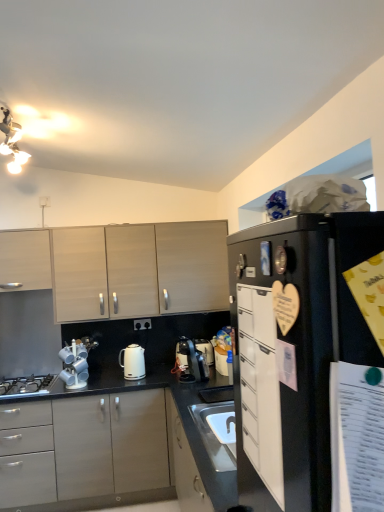
Question: In terms of height, does light wood/veneer cabinets at upper left, which ranks as the 4th cabinetry in front-to-back order, look taller or shorter compared to white glossy kettle at center?

Choices:
 (A) short
 (B) tall

Answer: (B)

Question: Visually, is light wood/veneer cabinets at upper left, the 1th cabinetry in the back-to-front sequence, positioned to the left or to the right of white glossy kettle at center?

Choices:
 (A) left
 (B) right

Answer: (B)

Question: Which is farther from the black matte refrigerator at upper right?

Choices:
 (A) white matte cabinet at right, arranged as the 1th cabinetry when viewed from the front
 (B) light wood/veneer cabinets at upper left, the 1th cabinetry in the back-to-front sequence
 (C) metallic silver cup rack at lower left
 (D) black matte gas stove at lower left
 (E) satin black coffee machine at center

Answer: (D)

Question: Estimate the real-world distances between objects in this image. Which object is farther from the white matte cabinet at right, acting as the 4th cabinetry starting from the back?

Choices:
 (A) black matte gas stove at lower left
 (B) light wood/veneer cabinets at upper left, which ranks as the 4th cabinetry in front-to-back order
 (C) satin black coffee machine at center
 (D) matte gray cabinets at center, which appears as the 3th cabinetry when viewed from the back
 (E) white glossy kettle at center

Answer: (A)